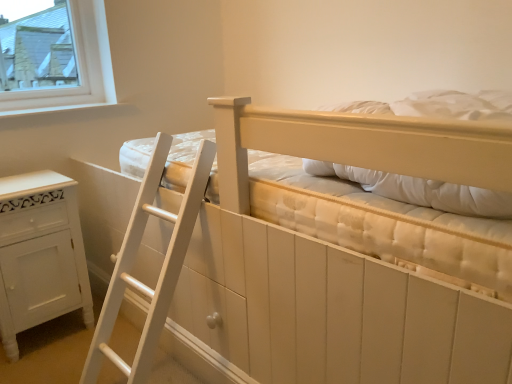
Question: Is white wood at upper left positioned far away from white painted wood cabinet at lower left?

Choices:
 (A) no
 (B) yes

Answer: (A)

Question: Can you confirm if white wood at upper left is wider than white painted wood cabinet at lower left?

Choices:
 (A) no
 (B) yes

Answer: (A)

Question: Is white wood at upper left turned away from white painted wood cabinet at lower left?

Choices:
 (A) yes
 (B) no

Answer: (B)

Question: Is white wood at upper left next to white painted wood cabinet at lower left and touching it?

Choices:
 (A) no
 (B) yes

Answer: (A)

Question: Is white wood at upper left shorter than white painted wood cabinet at lower left?

Choices:
 (A) no
 (B) yes

Answer: (B)

Question: Would you say white wood at upper left is to the left or to the right of white quilted pillow at upper right in the picture?

Choices:
 (A) right
 (B) left

Answer: (B)

Question: Is white wood at upper left taller or shorter than white quilted pillow at upper right?

Choices:
 (A) tall
 (B) short

Answer: (B)

Question: Is point (116, 102) closer or farther from the camera than point (503, 104)?

Choices:
 (A) farther
 (B) closer

Answer: (A)

Question: Which is correct: white wood at upper left is inside white quilted pillow at upper right, or outside of it?

Choices:
 (A) outside
 (B) inside

Answer: (A)

Question: From a real-world perspective, is white wood at upper left above or below white wood drawer at lower center?

Choices:
 (A) below
 (B) above

Answer: (B)

Question: In the image, is white wood at upper left positioned in front of or behind white wood drawer at lower center?

Choices:
 (A) behind
 (B) front

Answer: (A)

Question: Considering the positions of white wood at upper left and white wood drawer at lower center in the image, is white wood at upper left bigger or smaller than white wood drawer at lower center?

Choices:
 (A) small
 (B) big

Answer: (B)

Question: Is point (97, 104) positioned closer to the camera than point (217, 306)?

Choices:
 (A) farther
 (B) closer

Answer: (A)

Question: Is matte white bunk bed at center inside or outside of white quilted pillow at upper right?

Choices:
 (A) inside
 (B) outside

Answer: (B)

Question: From the image's perspective, is matte white bunk bed at center located above or below white quilted pillow at upper right?

Choices:
 (A) below
 (B) above

Answer: (A)